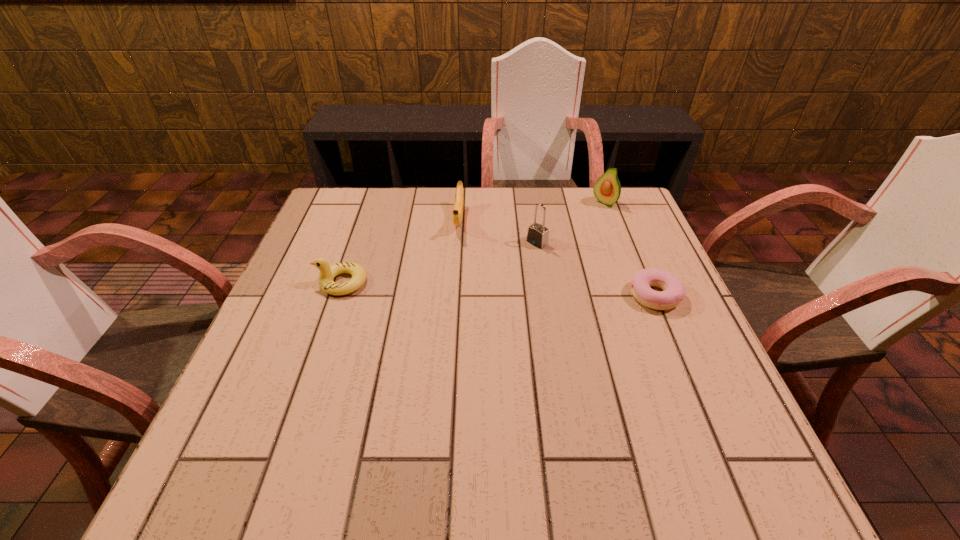
I want to click on the fourth tallest object, so click(327, 273).

Locate an element on the screen. The width and height of the screenshot is (960, 540). the leftmost object is located at coordinates (327, 273).

Where is `the shortest object`? the shortest object is located at coordinates (674, 291).

Where is `avocado`? avocado is located at coordinates (607, 189).

Where is `the third object from left to right`? Image resolution: width=960 pixels, height=540 pixels. the third object from left to right is located at coordinates (538, 235).

This screenshot has width=960, height=540. I want to click on the third shortest object, so click(457, 215).

The height and width of the screenshot is (540, 960). In order to click on banana in this screenshot , I will do `click(457, 215)`.

Identify the location of vacant region located on the back of the shortest object. The height and width of the screenshot is (540, 960). (620, 213).

Where is `free spot located 0.260m on the cut side of the avocado`? This screenshot has height=540, width=960. free spot located 0.260m on the cut side of the avocado is located at coordinates (552, 251).

Locate an element on the screen. The width and height of the screenshot is (960, 540). vacant region located on the cut side of the avocado is located at coordinates (581, 225).